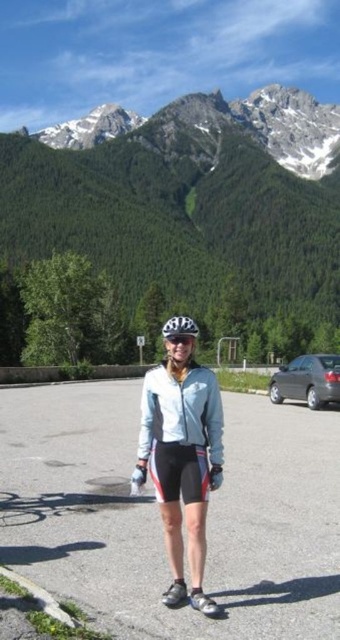
You are a photographer wanting to capture the person in the matte white shorts at center against the green forested mountain at upper center. Based on their positions, will the mountain appear behind the person in the photo?

Yes, the green forested mountain at upper center is above the matte white shorts at center, so the mountain will appear behind the person in the photo.

You are a photographer positioned at the edge of a parking lot, aiming to capture a cyclist wearing matte white shorts at center. Given that the shorts are 26.28 meters away, what is the minimum focal length required to ensure the shorts fill the frame without distortion?

The minimum focal length needed is determined by the distance and the sensor size of the camera. Assuming a full frame sensor with a diagonal of approximately 43.3mm, the formula is focal length equals sensor diagonal multiplied by distance divided by subject size. However, without knowing the exact size of the shorts, an exact calculation isn

From the picture: You are a photographer trying to capture the scenic mountain backdrop. You have two subjects in the frame, the light blue fabric jacket at center and the satin silver sedan at right. Which subject is closer to the camera?

The light blue fabric jacket at center is positioned over the satin silver sedan at right, meaning it is closer to the camera.